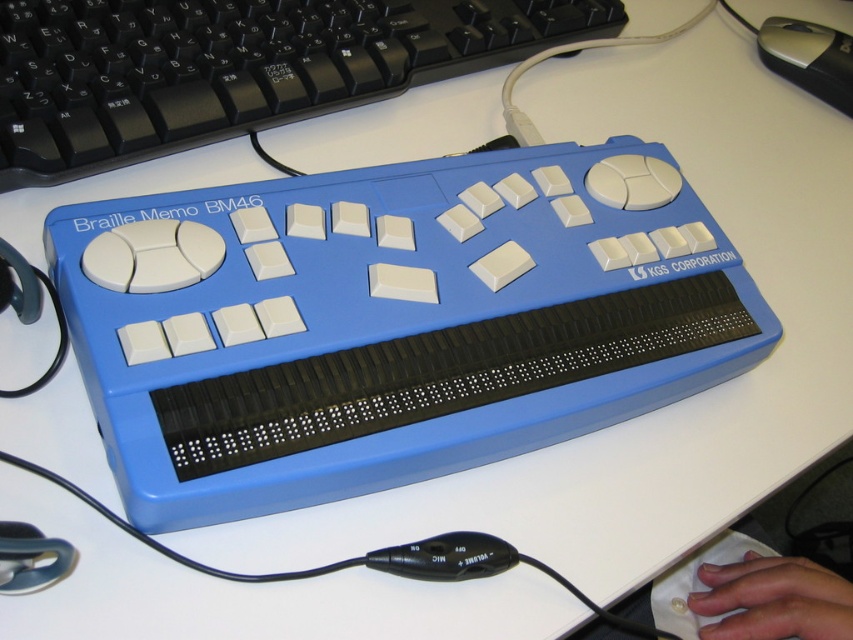
Question: Which of the following is the farthest from the observer?

Choices:
 (A) blue plastic keyboard at upper center
 (B) silver metallic mouse at upper right

Answer: (B)

Question: Where is blue plastic keyboard at upper center located in relation to silver metallic mouse at upper right in the image?

Choices:
 (A) below
 (B) above

Answer: (A)

Question: Which point is farther from the camera taking this photo?

Choices:
 (A) (15, 48)
 (B) (821, 86)

Answer: (B)

Question: Which of the following is the closest to the observer?

Choices:
 (A) blue plastic keyboard at upper center
 (B) silver metallic mouse at upper right

Answer: (A)

Question: Does blue plastic keyboard at upper center appear on the left side of silver metallic mouse at upper right?

Choices:
 (A) no
 (B) yes

Answer: (B)

Question: Does blue plastic keyboard at upper center come behind silver metallic mouse at upper right?

Choices:
 (A) yes
 (B) no

Answer: (B)